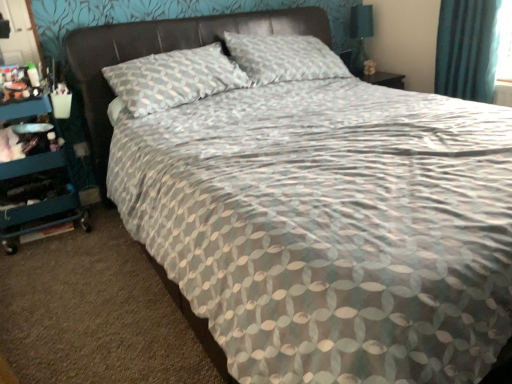
Question: Do you think leather-like headboard at upper center is within teal plastic dresser at left, or outside of it?

Choices:
 (A) inside
 (B) outside

Answer: (B)

Question: Relative to teal plastic dresser at left, is leather-like headboard at upper center in front or behind?

Choices:
 (A) front
 (B) behind

Answer: (A)

Question: Estimate the real-world distances between objects in this image. Which object is farther from the matte black table lamp at upper right?

Choices:
 (A) teal fabric curtain at upper right
 (B) teal plastic dresser at left
 (C) leather-like headboard at upper center

Answer: (B)

Question: Which object is the closest to the teal plastic dresser at left?

Choices:
 (A) leather-like headboard at upper center
 (B) matte black table lamp at upper right
 (C) teal fabric curtain at upper right

Answer: (A)